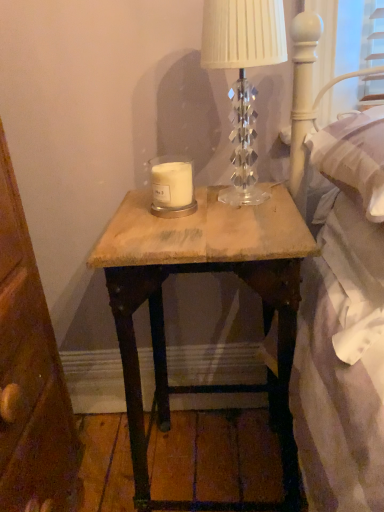
What are the coordinates of `vacant area to the right of white matte candle at center` in the screenshot? It's located at (241, 200).